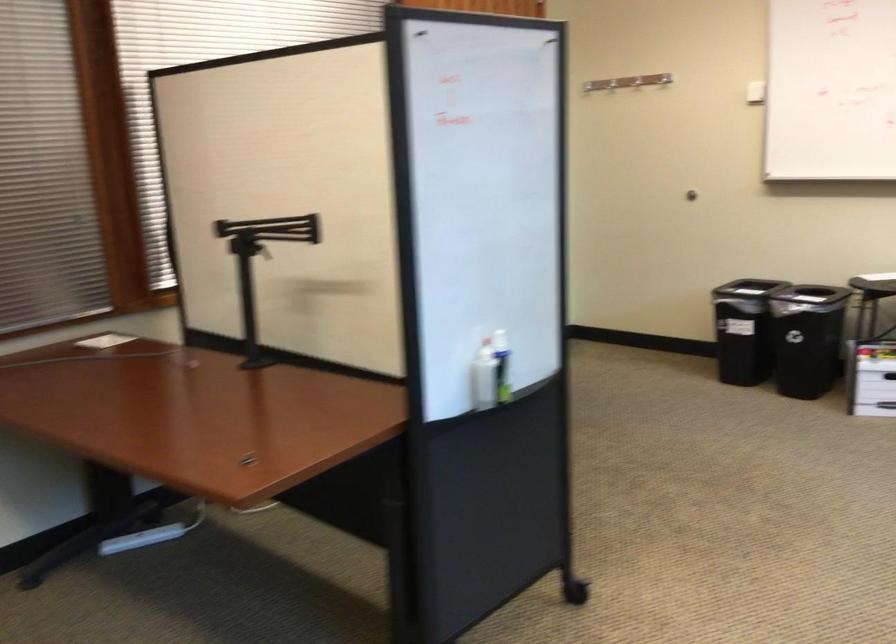
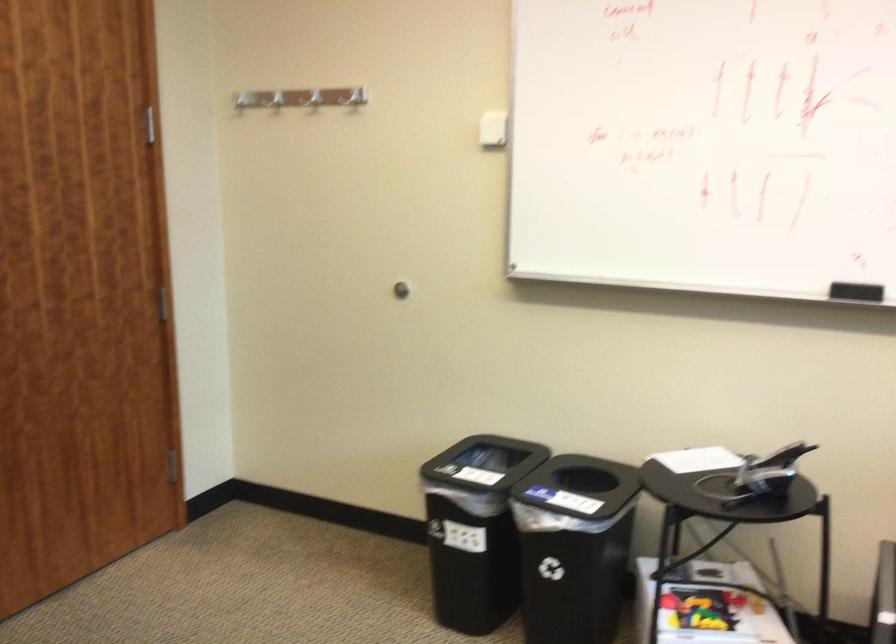
Which direction would the cameraman need to move to produce the second image?

The movement direction of the cameraman is right, forward.